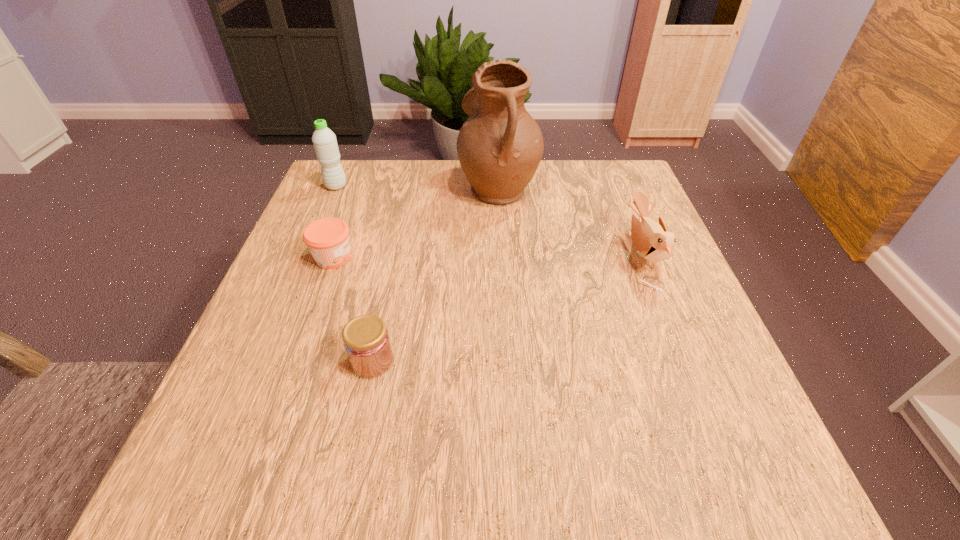
At what (x,y) coordinates should I click in order to perform the action: click on jam present at the left edge. Please return your answer as a coordinate pair (x, y). Looking at the image, I should click on (327, 239).

Where is `object that is at the right edge`? Image resolution: width=960 pixels, height=540 pixels. object that is at the right edge is located at coordinates (651, 239).

The height and width of the screenshot is (540, 960). In order to click on object at the far left corner in this screenshot , I will do `click(324, 140)`.

In the image, there is a desktop. Where is `free region at the far edge`? Image resolution: width=960 pixels, height=540 pixels. free region at the far edge is located at coordinates (457, 181).

In the image, there is a desktop. Identify the location of vacant space at the near edge. (623, 498).

The image size is (960, 540). Find the location of `free space at the left edge`. free space at the left edge is located at coordinates (291, 245).

The image size is (960, 540). Find the location of `vacant space at the right edge`. vacant space at the right edge is located at coordinates (678, 416).

Locate an element on the screen. vacant point at the far left corner is located at coordinates (356, 160).

Identify the location of blank region between the nearest object and the bird. (507, 308).

At what (x,y) coordinates should I click in order to perform the action: click on unoccupied area between the second object from right to left and the nearest object. Please return your answer as a coordinate pair (x, y). The image size is (960, 540). Looking at the image, I should click on (436, 274).